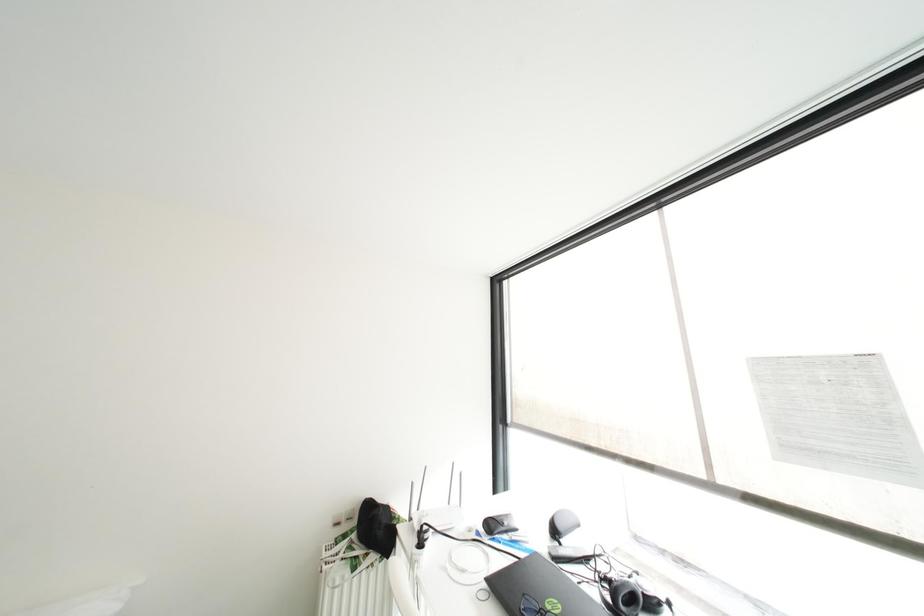
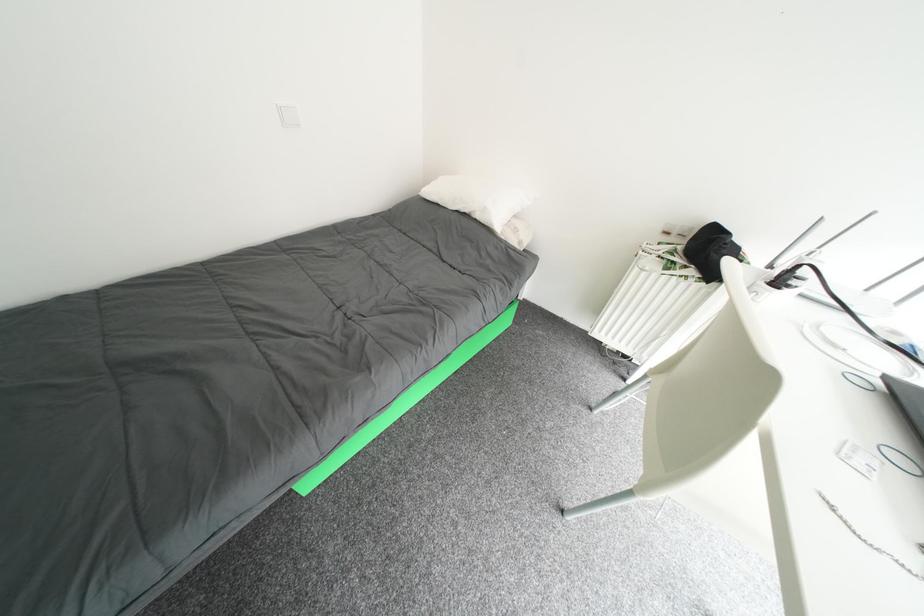
Based on the continuous images, in which direction is the camera rotating?

The camera rotated toward left-down.